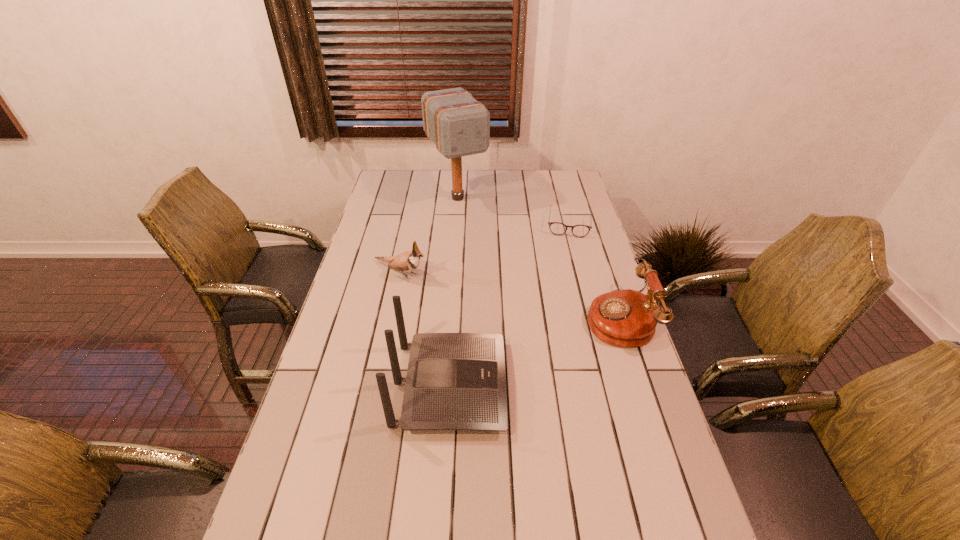
The width and height of the screenshot is (960, 540). What are the coordinates of `free space between the telephone and the tallest object` in the screenshot? It's located at (538, 258).

The image size is (960, 540). What are the coordinates of `free area in between the mallet and the telephone` in the screenshot? It's located at (538, 258).

Image resolution: width=960 pixels, height=540 pixels. I want to click on free space between the tallest object and the router, so click(x=454, y=292).

Where is `vacant space that is in between the bird and the shortest object`? vacant space that is in between the bird and the shortest object is located at coordinates (485, 248).

Identify the location of free space between the telephone and the bird. (510, 295).

Identify the location of vacant space that's between the tallest object and the second tallest object. The image size is (960, 540). (454, 292).

At what (x,y) coordinates should I click in order to perform the action: click on object that is the nearest to the router. Please return your answer as a coordinate pair (x, y). This screenshot has width=960, height=540. Looking at the image, I should click on (408, 261).

This screenshot has width=960, height=540. In order to click on the fourth closest object relative to the spectacles in this screenshot , I will do `click(455, 381)`.

The width and height of the screenshot is (960, 540). I want to click on vacant space that satisfies the following two spatial constraints: 1. on the front side of the mallet; 2. on the front-facing side of the router, so click(x=444, y=386).

Identify the location of free space that satisfies the following two spatial constraints: 1. on the front side of the bird; 2. on the front-facing side of the fourth shortest object. (376, 386).